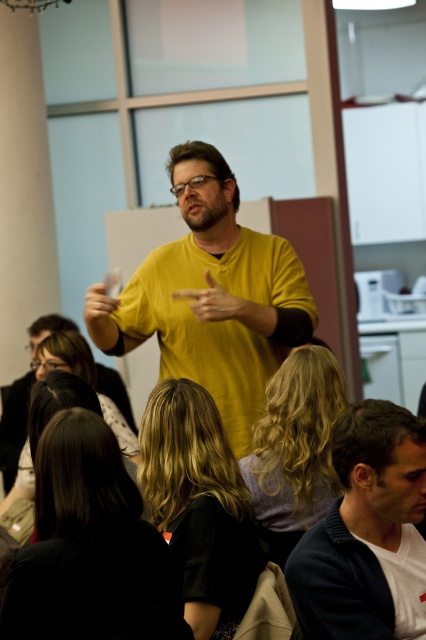
You are an observer in the classroom scene. You notice the yellow matte shirt at center and the dark blue sweater at lower right. Which clothing item appears bigger in the image?

The yellow matte shirt at center appears larger in size than the dark blue sweater at lower right according to the description.

In the scene shown: You are standing in the classroom and want to locate the speaker. Where is the yellow matte shirt at center located in terms of coordinates?

The yellow matte shirt at center is located at coordinates point (x=210, y=296).

You are sitting at the back of the room and want to see the speaker better. Is the dark blue sweater at lower right blocking your view of the yellow matte shirt at center?

The dark blue sweater at lower right is behind the yellow matte shirt at center, so it is not blocking your view. You should have a clear sightline to the yellow matte shirt at center.